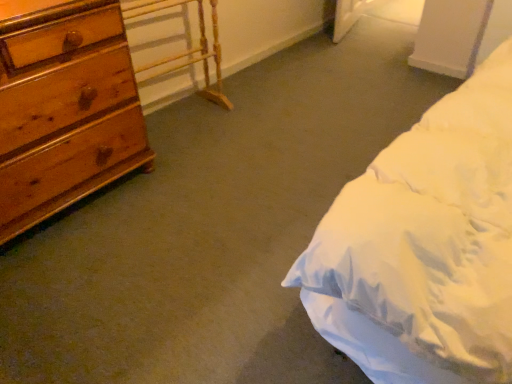
Question: From a real-world perspective, is wooden table at left physically below wooden chest of drawers at left?

Choices:
 (A) yes
 (B) no

Answer: (A)

Question: Is wooden table at left looking in the opposite direction of wooden chest of drawers at left?

Choices:
 (A) yes
 (B) no

Answer: (B)

Question: Considering the relative positions of wooden table at left and wooden chest of drawers at left in the image provided, is wooden table at left behind wooden chest of drawers at left?

Choices:
 (A) no
 (B) yes

Answer: (B)

Question: Can you confirm if wooden table at left is smaller than wooden chest of drawers at left?

Choices:
 (A) yes
 (B) no

Answer: (A)

Question: From the image's perspective, is wooden table at left beneath wooden chest of drawers at left?

Choices:
 (A) yes
 (B) no

Answer: (B)

Question: Is wooden table at left outside wooden chest of drawers at left?

Choices:
 (A) no
 (B) yes

Answer: (B)

Question: From the image's perspective, would you say wooden chest of drawers at left is positioned over wooden table at left?

Choices:
 (A) yes
 (B) no

Answer: (B)

Question: Does wooden chest of drawers at left have a greater width compared to wooden table at left?

Choices:
 (A) no
 (B) yes

Answer: (B)

Question: Does wooden chest of drawers at left have a larger size compared to wooden table at left?

Choices:
 (A) no
 (B) yes

Answer: (B)

Question: Is wooden chest of drawers at left oriented away from wooden table at left?

Choices:
 (A) yes
 (B) no

Answer: (B)

Question: Could you tell me if wooden chest of drawers at left is turned towards wooden table at left?

Choices:
 (A) no
 (B) yes

Answer: (A)

Question: Considering the relative positions of wooden chest of drawers at left and wooden table at left in the image provided, is wooden chest of drawers at left to the right of wooden table at left from the viewer's perspective?

Choices:
 (A) no
 (B) yes

Answer: (A)

Question: Do you think wooden table at left is within wooden chest of drawers at left, or outside of it?

Choices:
 (A) inside
 (B) outside

Answer: (B)